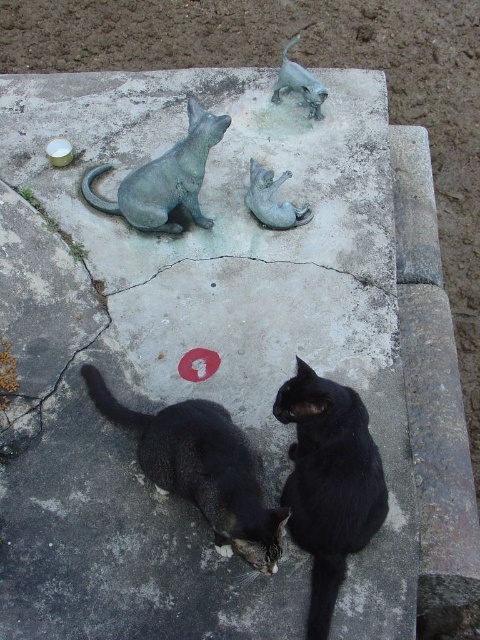
Between black matte cat at lower right and shiny black cat at lower center, which one is positioned lower?

black matte cat at lower right is lower down.

Which is above, black matte cat at lower right or shiny black cat at lower center?

shiny black cat at lower center is above.

Where is `black matte cat at lower right`? This screenshot has height=640, width=480. black matte cat at lower right is located at coordinates (328, 483).

Measure the distance between point (371, 444) and camera.

7.03 feet

Which of these two, black matte cat at lower right or bronze cat at upper left, stands shorter?

With less height is bronze cat at upper left.

At what (x,y) coordinates should I click in order to perform the action: click on black matte cat at lower right. Please return your answer as a coordinate pair (x, y). The width and height of the screenshot is (480, 640). Looking at the image, I should click on (328, 483).

What do you see at coordinates (328, 483) in the screenshot? I see `black matte cat at lower right` at bounding box center [328, 483].

Which is behind, point (294, 396) or point (268, 204)?

Positioned behind is point (268, 204).

Locate an element on the screen. black matte cat at lower right is located at coordinates (328, 483).